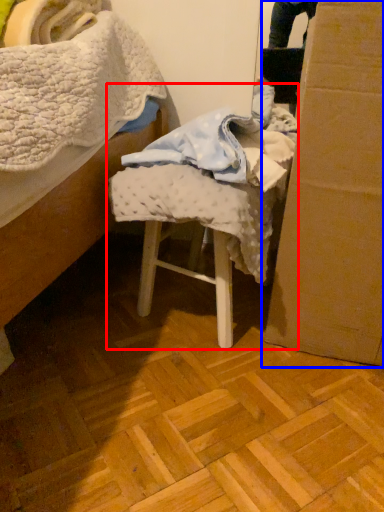
Question: Which object appears farthest to the camera in this image, chair (highlighted by a red box) or cardboard box (highlighted by a blue box)?

Choices:
 (A) chair
 (B) cardboard box

Answer: (A)